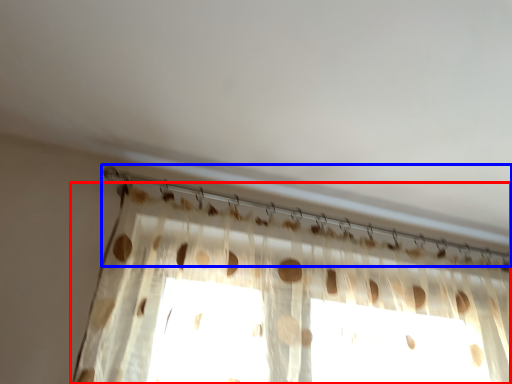
Question: Which of the following is the farthest to the observer, curtain (highlighted by a red box) or clothesline (highlighted by a blue box)?

Choices:
 (A) curtain
 (B) clothesline

Answer: (B)